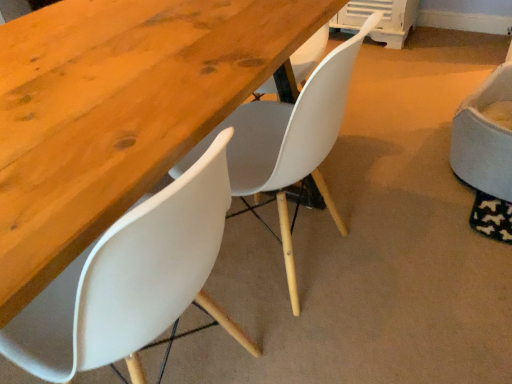
Question: Is white fabric chair at right, which is the 3th chair from left to right, further to the viewer compared to wooden table at center?

Choices:
 (A) yes
 (B) no

Answer: (A)

Question: From a real-world perspective, is white fabric chair at right, which appears as the 1th chair when viewed from the right, under wooden table at center?

Choices:
 (A) no
 (B) yes

Answer: (B)

Question: Is white fabric chair at right, which is the 3th chair from left to right, bigger than wooden table at center?

Choices:
 (A) no
 (B) yes

Answer: (A)

Question: Does white fabric chair at right, which is the 3th chair from left to right, have a greater width compared to wooden table at center?

Choices:
 (A) no
 (B) yes

Answer: (A)

Question: Is white fabric chair at right, which is the 3th chair from left to right, at the right side of wooden table at center?

Choices:
 (A) yes
 (B) no

Answer: (A)

Question: Can you confirm if white fabric chair at right, which is the 3th chair from left to right, is smaller than wooden table at center?

Choices:
 (A) yes
 (B) no

Answer: (A)

Question: Is white fabric chair at right, which is the 3th chair from left to right, far from white plastic chair at lower left, the first chair positioned from the left?

Choices:
 (A) yes
 (B) no

Answer: (A)

Question: Is white fabric chair at right, which is the 3th chair from left to right, in contact with white plastic chair at lower left, the 3th chair viewed from the right?

Choices:
 (A) yes
 (B) no

Answer: (B)

Question: Is the position of white fabric chair at right, which is the 3th chair from left to right, less distant than that of white plastic chair at lower left, the first chair positioned from the left?

Choices:
 (A) no
 (B) yes

Answer: (A)

Question: Considering the relative positions of white fabric chair at right, which appears as the 1th chair when viewed from the right, and white plastic chair at lower left, the 3th chair viewed from the right, in the image provided, is white fabric chair at right, which appears as the 1th chair when viewed from the right, behind white plastic chair at lower left, the 3th chair viewed from the right,?

Choices:
 (A) no
 (B) yes

Answer: (B)

Question: From a real-world perspective, is white fabric chair at right, which appears as the 1th chair when viewed from the right, located higher than white plastic chair at lower left, the 3th chair viewed from the right?

Choices:
 (A) no
 (B) yes

Answer: (A)

Question: Is white fabric chair at right, which is the 3th chair from left to right, not inside white plastic chair at lower left, the 3th chair viewed from the right?

Choices:
 (A) no
 (B) yes

Answer: (B)

Question: Can you confirm if white fabric chair at right, which is the 3th chair from left to right, is smaller than white matte chair at center, which ranks as the second chair in right-to-left order?

Choices:
 (A) no
 (B) yes

Answer: (B)